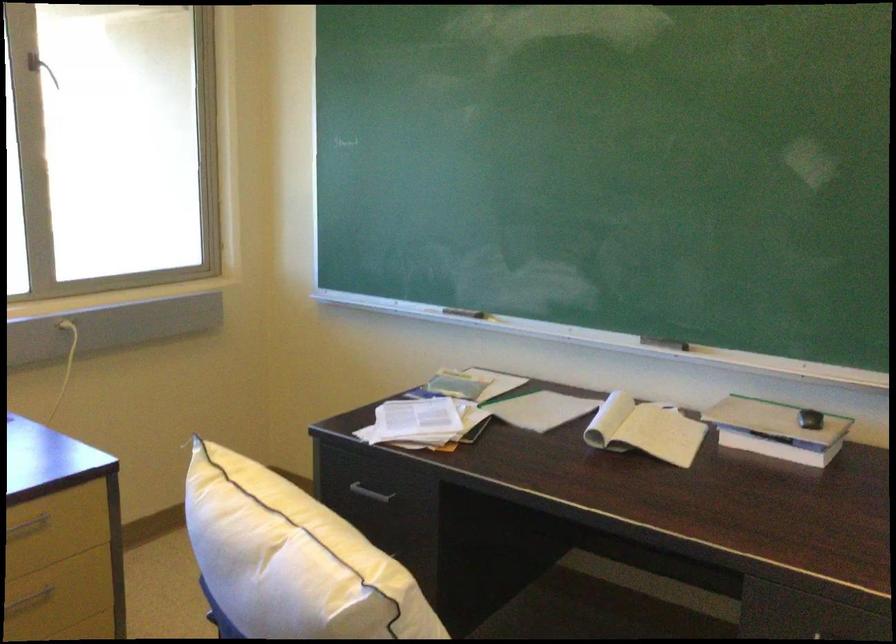
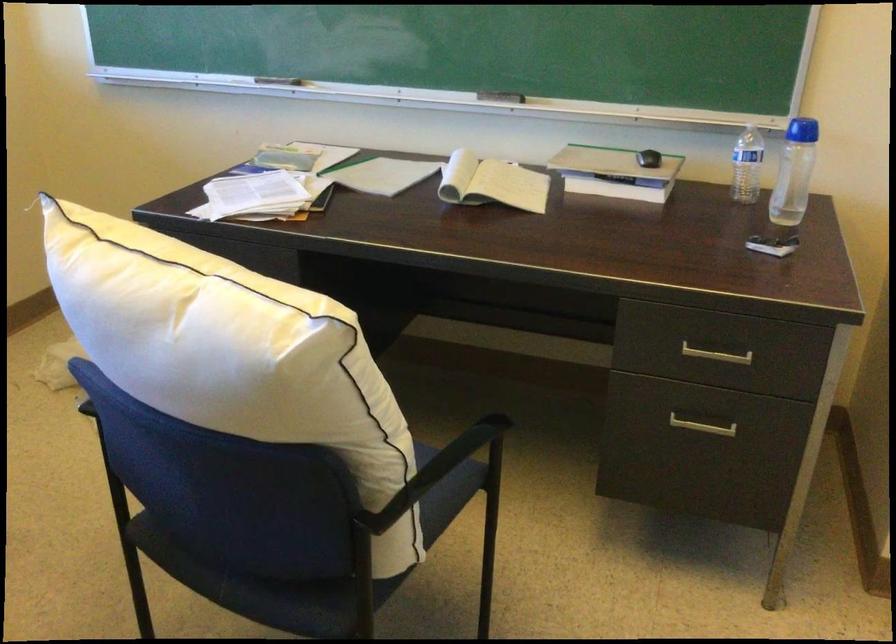
Locate, in the second image, the point that corresponds to (x=664, y=337) in the first image.

(501, 96)